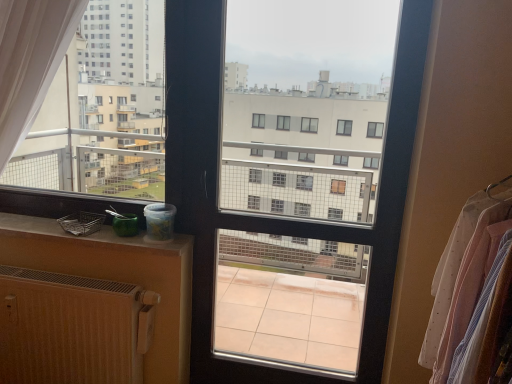
Identify the location of white sheer fabric at right. The height and width of the screenshot is (384, 512). (460, 278).

Find the location of a particular element. The width and height of the screenshot is (512, 384). wooden radiator at lower left is located at coordinates (72, 328).

Describe the element at coordinates (306, 105) in the screenshot. I see `clear glass window screen at center` at that location.

Measure the distance between point (368, 34) and camera.

A distance of 6.20 feet exists between point (368, 34) and camera.

At what (x,y) coordinates should I click in order to perform the action: click on white sheer fabric at right. Please return your answer as a coordinate pair (x, y). Looking at the image, I should click on (460, 278).

Does matte plastic container at lower left turn towards wooden radiator at lower left?

No, matte plastic container at lower left is not turned towards wooden radiator at lower left.

What's the angular difference between matte plastic container at lower left and wooden radiator at lower left's facing directions?

The facing directions of matte plastic container at lower left and wooden radiator at lower left are 1.28 degrees apart.

Considering the sizes of objects matte plastic container at lower left and wooden radiator at lower left in the image provided, who is bigger, matte plastic container at lower left or wooden radiator at lower left?

With larger size is wooden radiator at lower left.

From the image's perspective, which one is positioned lower, matte plastic container at lower left or wooden radiator at lower left?

wooden radiator at lower left appears lower in the image.

From their relative heights in the image, would you say white sheer fabric at right is taller or shorter than wooden radiator at lower left?

white sheer fabric at right is taller than wooden radiator at lower left.

Which is closer to the camera, (477, 211) or (123, 297)?

The point (477, 211) is closer.

From a real-world perspective, which is physically below, white sheer fabric at right or wooden radiator at lower left?

From a 3D spatial view, wooden radiator at lower left is below.

Which of these two, white sheer fabric at right or wooden radiator at lower left, is smaller?

Smaller between the two is wooden radiator at lower left.

Between white matte plastic container at left and clear glass window screen at center, which one is positioned in front?

Positioned in front is clear glass window screen at center.

Where is `window screen that is below the white matte plastic container at left (from the image's perspective)`? window screen that is below the white matte plastic container at left (from the image's perspective) is located at coordinates (306, 105).

From a real-world perspective, between white matte plastic container at left and clear glass window screen at center, who is vertically higher?

white matte plastic container at left is physically above.

Is white matte plastic container at left at the right side of clear glass window screen at center?

In fact, white matte plastic container at left is to the left of clear glass window screen at center.

How different are the orientations of white matte plastic container at left and wooden radiator at lower left in degrees?

The facing directions of white matte plastic container at left and wooden radiator at lower left are 0.0398 degrees apart.

Which is nearer, (73, 171) or (14, 370)?

The point (14, 370) is in front.

In the scene shown: Is wooden radiator at lower left completely or partially inside white matte plastic container at left?

No.

From the picture: Is white matte plastic container at left looking in the opposite direction of wooden radiator at lower left?

No, wooden radiator at lower left is not at the back of white matte plastic container at left.

Is wooden radiator at lower left facing away from matte plastic container at lower left?

No, wooden radiator at lower left is not facing the opposite direction of matte plastic container at lower left.

Between wooden radiator at lower left and matte plastic container at lower left, which one has less height?

Standing shorter between the two is matte plastic container at lower left.

How different are the orientations of wooden radiator at lower left and matte plastic container at lower left in degrees?

wooden radiator at lower left and matte plastic container at lower left are facing 1.28 degrees away from each other.

Which is more to the left, wooden radiator at lower left or matte plastic container at lower left?

wooden radiator at lower left.

How many degrees apart are the facing directions of matte plastic container at lower left and white matte plastic container at left?

The angular difference between matte plastic container at lower left and white matte plastic container at left is 1.31 degrees.

Is matte plastic container at lower left touching white matte plastic container at left?

No, matte plastic container at lower left is not in contact with white matte plastic container at left.

Considering the positions of objects matte plastic container at lower left and white matte plastic container at left in the image provided, who is more to the right, matte plastic container at lower left or white matte plastic container at left?

From the viewer's perspective, white matte plastic container at left appears more on the right side.

The width and height of the screenshot is (512, 384). Find the location of `radiator behind the clear glass window screen at center`. radiator behind the clear glass window screen at center is located at coordinates (72, 328).

Which is correct: clear glass window screen at center is inside wooden radiator at lower left, or outside of it?

clear glass window screen at center lies outside wooden radiator at lower left.

Based on the photo, is clear glass window screen at center thinner than wooden radiator at lower left?

In fact, clear glass window screen at center might be wider than wooden radiator at lower left.

Identify the location of window sill above the wooden radiator at lower left (from the image's perspective). (80, 237).

This screenshot has height=384, width=512. In order to click on clothing located on the right of wooden radiator at lower left in this screenshot , I will do `click(460, 278)`.

From the image, which object appears to be nearer to white matte plastic container at left, wooden radiator at lower left or clear glass window screen at center?

wooden radiator at lower left is positioned closer to the anchor white matte plastic container at left.

Estimate the real-world distances between objects in this image. Which object is further from white matte plastic container at left, white sheer fabric at right or wooden radiator at lower left?

white sheer fabric at right lies further to white matte plastic container at left than the other object.

Which object lies further to the anchor point wooden radiator at lower left, clear glass window screen at center or matte plastic container at lower left?

Among the two, clear glass window screen at center is located further to wooden radiator at lower left.

Estimate the real-world distances between objects in this image. Which object is further from wooden radiator at lower left, clear glass window screen at center or white matte plastic container at left?

clear glass window screen at center is positioned further to the anchor wooden radiator at lower left.

Based on their spatial positions, is white sheer fabric at right or white matte plastic container at left further from clear glass window screen at center?

white sheer fabric at right is further to clear glass window screen at center.

Looking at the image, which one is located further to clear glass window screen at center, wooden radiator at lower left or white sheer fabric at right?

Based on the image, white sheer fabric at right appears to be further to clear glass window screen at center.

Estimate the real-world distances between objects in this image. Which object is further from white matte plastic container at left, matte plastic container at lower left or wooden radiator at lower left?

The object further to white matte plastic container at left is wooden radiator at lower left.

Looking at the image, which one is located further to wooden radiator at lower left, matte plastic container at lower left or white sheer fabric at right?

The object further to wooden radiator at lower left is white sheer fabric at right.

I want to click on window sill between wooden radiator at lower left and clear glass window screen at center in the horizontal direction, so click(80, 237).

This screenshot has height=384, width=512. I want to click on condominium between matte plastic container at lower left and white sheer fabric at right, so click(x=106, y=109).

Locate an element on the screen. This screenshot has height=384, width=512. condominium between wooden radiator at lower left and clear glass window screen at center in the horizontal direction is located at coordinates (106, 109).

Identify the location of window screen located between matte plastic container at lower left and white sheer fabric at right in the left-right direction. (306, 105).